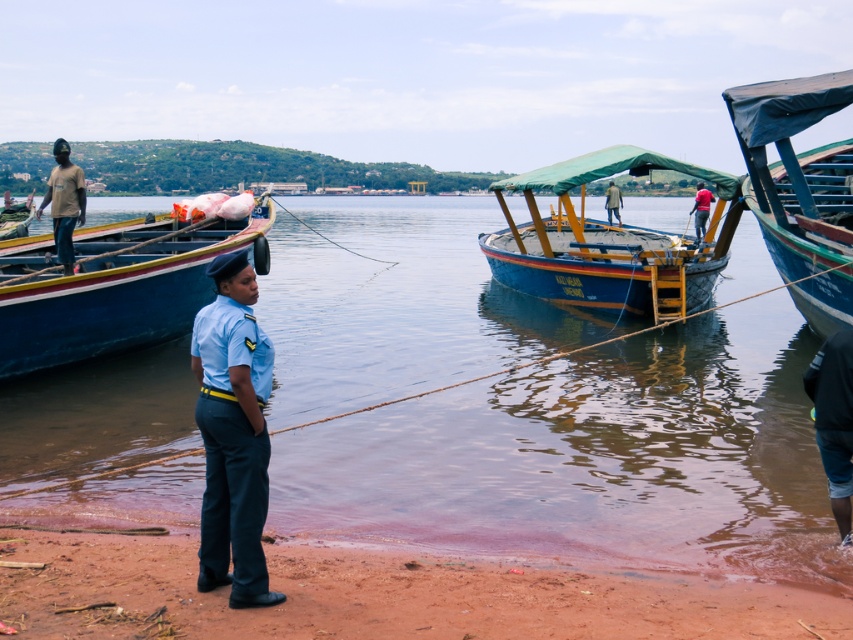
Does point (248, 486) lie behind point (709, 200)?

No, (248, 486) is closer to viewer.

Is light blue uniform at center smaller than red fabric shirt at center?

Yes.

Find the location of a particular element. This screenshot has width=853, height=640. light blue uniform at center is located at coordinates (231, 433).

Where is `light blue uniform at center`? light blue uniform at center is located at coordinates (231, 433).

Is point (181, 541) in front of point (262, 378)?

No, it is behind (262, 378).

Image resolution: width=853 pixels, height=640 pixels. Find the location of `brown sand at lower left`. brown sand at lower left is located at coordinates pyautogui.click(x=373, y=595).

Does clear water at center have a lesser width compared to dark blue denim shorts at lower right?

No, clear water at center is not thinner than dark blue denim shorts at lower right.

Between clear water at center and dark blue denim shorts at lower right, which one appears on the left side from the viewer's perspective?

clear water at center

Measure the distance between clear water at center and camera.

clear water at center is 17.83 feet away from camera.

The image size is (853, 640). I want to click on clear water at center, so click(593, 458).